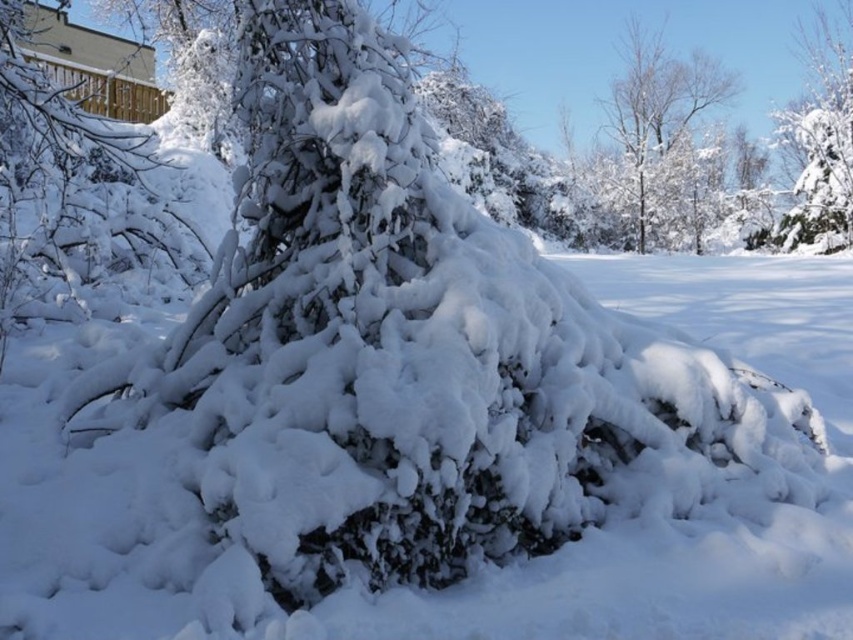
Between white snow-covered tree at upper right and white fluffy snow at upper right, which one has less height?

Standing shorter between the two is white fluffy snow at upper right.

Describe the element at coordinates (654, 140) in the screenshot. I see `white snow-covered tree at upper right` at that location.

This screenshot has width=853, height=640. In order to click on white snow-covered tree at upper right in this screenshot , I will do `click(654, 140)`.